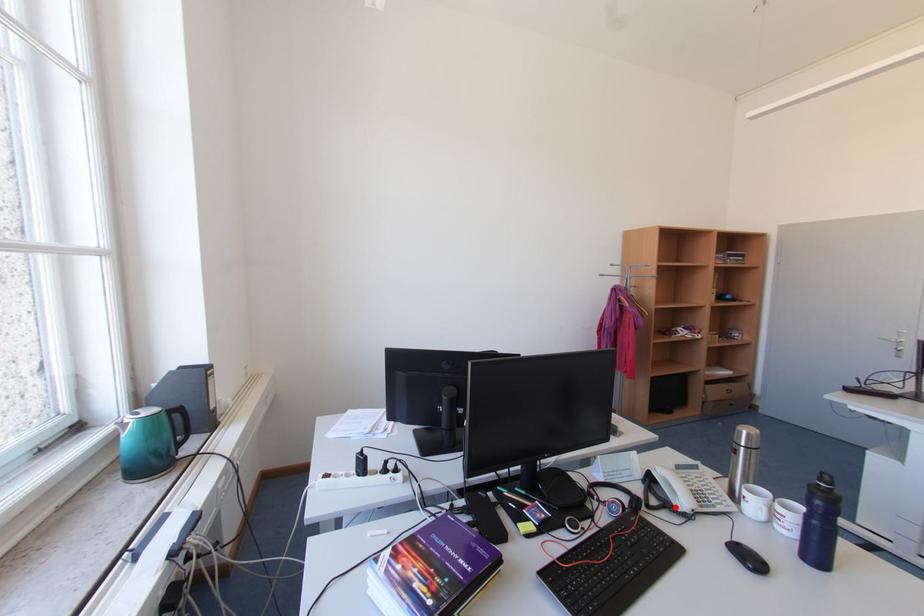
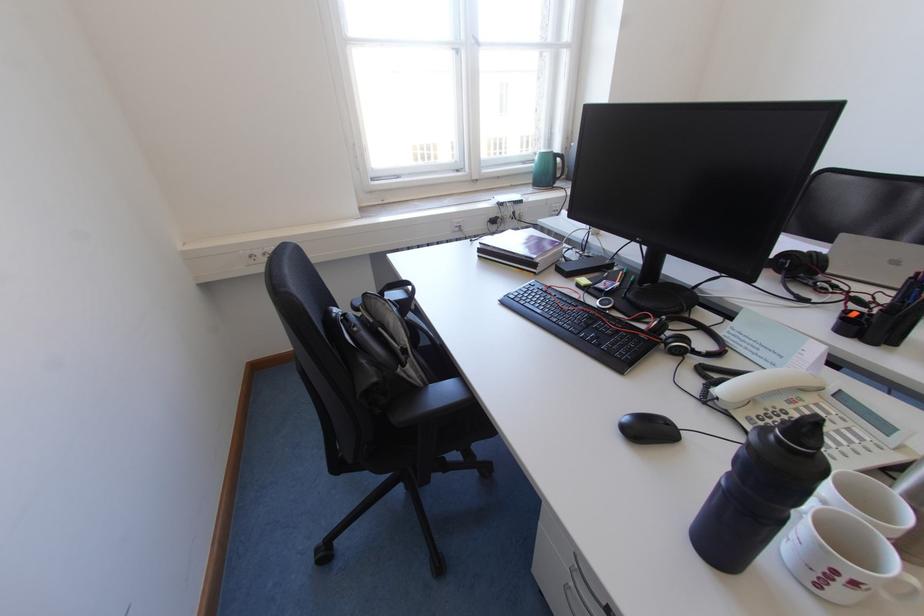
Find the pixel in the second image that matches the highlighted location in the first image.

(723, 384)